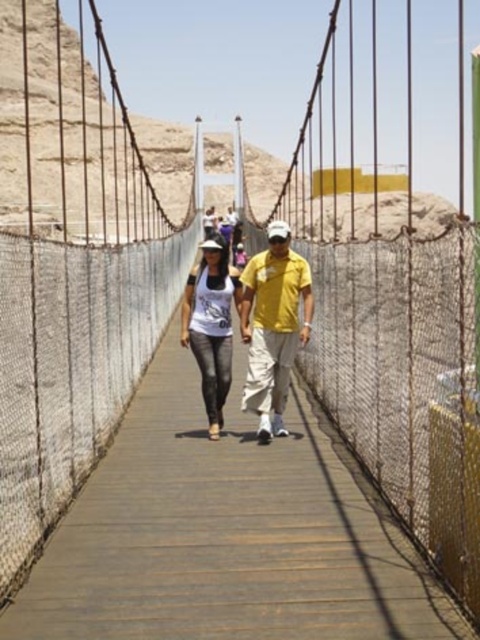
You are a photographer standing on the suspension bridge and want to take a photo of both the yellow matte shirt at center and the matte white tank top at center. Which person should you focus on first if you want to capture the taller clothing item?

The matte white tank top at center is taller than the yellow matte shirt at center, so you should focus on the matte white tank top at center first to capture the taller clothing item.

You are standing on the suspension bridge and want to know if the yellow matte shirt at center is closer to you than the matte white tank top at center. Can you determine this based on their positions?

The yellow matte shirt at center is 16.74 feet from matte white tank top at center. Since both are at the center of the bridge, their distance from you depends on your exact position. If you are standing between them, the one closer to you would be nearer, but without knowing your location, it can not be determined.

You are standing on the suspension bridge and see the point marked at coordinates (273, 324). What object is located at that point?

The point at coordinates (273, 324) indicates the yellow matte shirt at center.